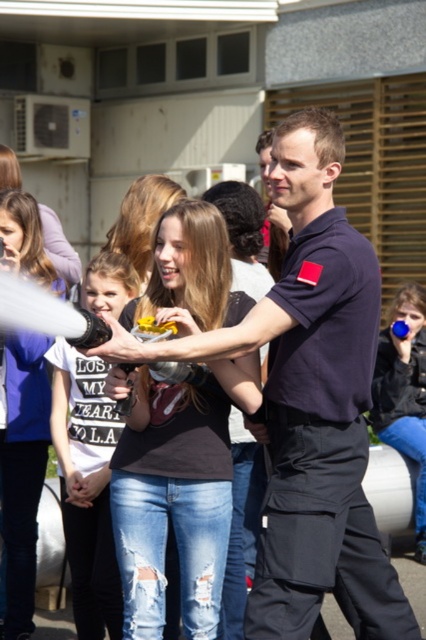
Can you confirm if dark blue uniform at center is thinner than white cotton shirt at center?

Incorrect, dark blue uniform at center's width is not less than white cotton shirt at center's.

Is dark blue uniform at center below white cotton shirt at center?

No.

Does point (173, 355) come in front of point (104, 298)?

Yes, point (173, 355) is in front of point (104, 298).

Where is `dark blue uniform at center`? dark blue uniform at center is located at coordinates (310, 403).

Is white cotton shirt at center further to camera compared to matte black hair at center?

That is False.

Is point (88, 276) farther from viewer compared to point (155, 193)?

No, (88, 276) is closer to viewer.

You are a GUI agent. You are given a task and a screenshot of the screen. Output one action in this format:
    pyautogui.click(x=<x>, y=<y>)
    Task: Click on the white cotton shirt at center
    
    Given the screenshot: What is the action you would take?
    pyautogui.click(x=86, y=486)

Which is more to the right, denim jeans at center or matte black shirt at center?

denim jeans at center

Find the location of a particular element. denim jeans at center is located at coordinates (22, 472).

Identify the location of denim jeans at center. The width and height of the screenshot is (426, 640). (22, 472).